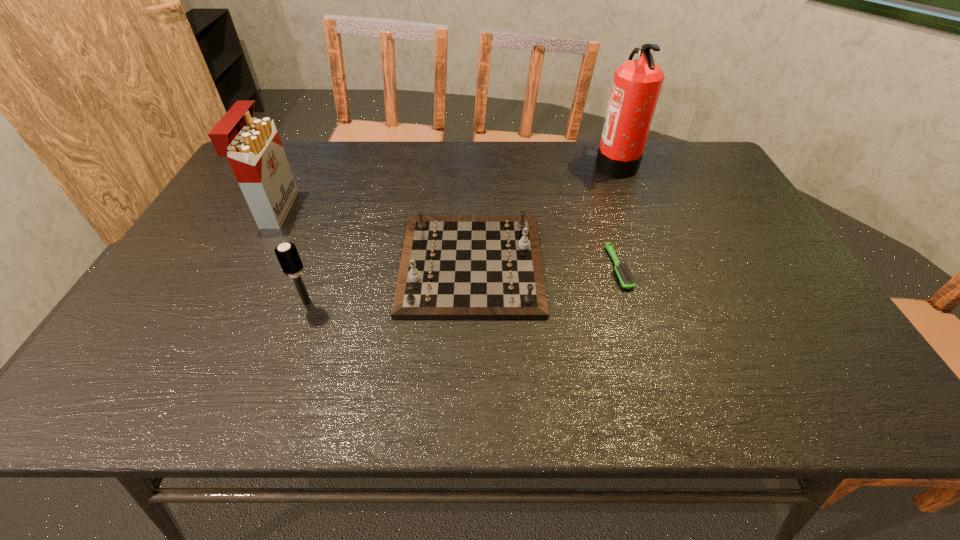
Select which object is the second closest to the chessboard. Please provide its 2D coordinates. Your answer should be formatted as a tuple, i.e. [(x, y)], where the tuple contains the x and y coordinates of a point satisfying the conditions above.

[(287, 254)]

The width and height of the screenshot is (960, 540). What are the coordinates of `vacant space that satisfies the following two spatial constraints: 1. on the board of the second shortest object; 2. on the left side of the right hairbrush` in the screenshot? It's located at (471, 268).

This screenshot has width=960, height=540. Identify the location of free space that satisfies the following two spatial constraints: 1. on the back side of the right hairbrush; 2. on the board of the third object from left to right. (617, 264).

Identify the location of vacant region that satisfies the following two spatial constraints: 1. on the back side of the taller hairbrush; 2. with the lid open on the leftmost object. The height and width of the screenshot is (540, 960). (341, 209).

This screenshot has height=540, width=960. What are the coordinates of `vacant space that satisfies the following two spatial constraints: 1. on the board of the chessboard; 2. on the back side of the right hairbrush` in the screenshot? It's located at (471, 268).

Find the location of a particular element. The image size is (960, 540). free space that satisfies the following two spatial constraints: 1. with the lid open on the second tallest object; 2. on the right side of the farther hairbrush is located at coordinates (246, 268).

You are a GUI agent. You are given a task and a screenshot of the screen. Output one action in this format:
    pyautogui.click(x=<x>, y=<y>)
    Task: Click on the free point that satisfies the following two spatial constraints: 1. on the board of the second shortest object; 2. on the back side of the right hairbrush
    
    Given the screenshot: What is the action you would take?
    pyautogui.click(x=471, y=268)

You are a GUI agent. You are given a task and a screenshot of the screen. Output one action in this format:
    pyautogui.click(x=<x>, y=<y>)
    Task: Click on the free location that satisfies the following two spatial constraints: 1. on the board of the chessboard; 2. on the left side of the shortest object
    This screenshot has width=960, height=540.
    Given the screenshot: What is the action you would take?
    tap(471, 268)